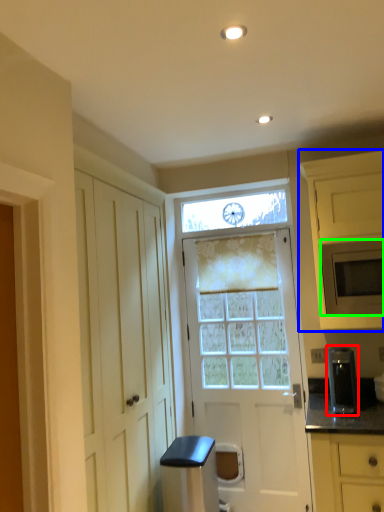
Question: Which is nearer to the appliance (highlighted by a red box)? cabinetry (highlighted by a blue box) or microwave oven (highlighted by a green box).

Choices:
 (A) cabinetry
 (B) microwave oven

Answer: (B)